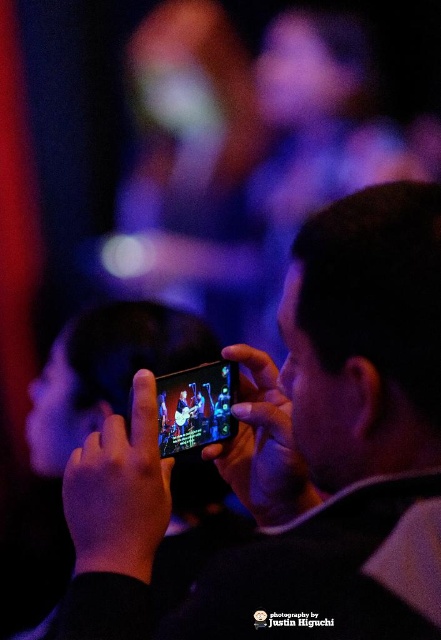
Between point (148, 435) and point (220, 381), which one is positioned behind?

The point (220, 381) is behind.

Is black matte phone at center smaller than black glossy smartphone at center?

No.

What do you see at coordinates (295, 456) in the screenshot? I see `black matte phone at center` at bounding box center [295, 456].

Where is `black matte phone at center`? The height and width of the screenshot is (640, 441). black matte phone at center is located at coordinates (295, 456).